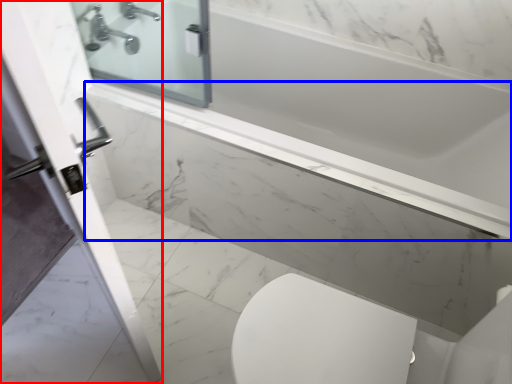
Question: Which point is closer to the camera, screen door (highlighted by a red box) or ledge (highlighted by a blue box)?

Choices:
 (A) screen door
 (B) ledge

Answer: (A)